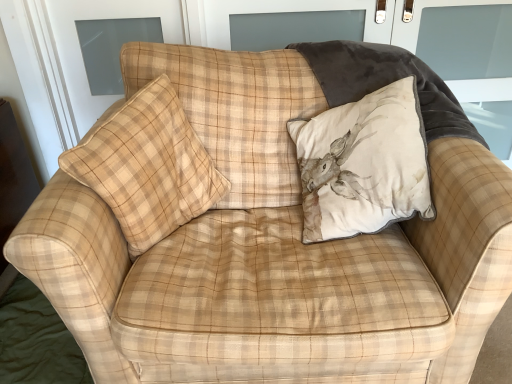
Question: From a real-world perspective, is beige plaid pillow at center, placed as the first pillow when sorted from left to right, beneath beige velvet cushion with deer print at upper right, acting as the 2th pillow starting from the left?

Choices:
 (A) no
 (B) yes

Answer: (A)

Question: Would you consider beige plaid pillow at center, placed as the first pillow when sorted from left to right, to be distant from beige velvet cushion with deer print at upper right, acting as the 2th pillow starting from the left?

Choices:
 (A) no
 (B) yes

Answer: (A)

Question: From the image's perspective, is beige plaid pillow at center, marked as the 2th pillow in a right-to-left arrangement, located above beige velvet cushion with deer print at upper right, the first pillow viewed from the right?

Choices:
 (A) no
 (B) yes

Answer: (A)

Question: Is beige plaid pillow at center, marked as the 2th pillow in a right-to-left arrangement, aimed at beige velvet cushion with deer print at upper right, the first pillow viewed from the right?

Choices:
 (A) yes
 (B) no

Answer: (B)

Question: Is beige plaid pillow at center, marked as the 2th pillow in a right-to-left arrangement, closer to the viewer compared to beige velvet cushion with deer print at upper right, the first pillow viewed from the right?

Choices:
 (A) no
 (B) yes

Answer: (B)

Question: From the image's perspective, is beige plaid pillow at center, placed as the first pillow when sorted from left to right, located beneath beige velvet cushion with deer print at upper right, the first pillow viewed from the right?

Choices:
 (A) yes
 (B) no

Answer: (A)

Question: Is velvet screen door at upper right aimed at beige velvet cushion with deer print at upper right, acting as the 2th pillow starting from the left?

Choices:
 (A) no
 (B) yes

Answer: (A)

Question: Considering the relative sizes of velvet screen door at upper right and beige velvet cushion with deer print at upper right, acting as the 2th pillow starting from the left, in the image provided, is velvet screen door at upper right smaller than beige velvet cushion with deer print at upper right, acting as the 2th pillow starting from the left,?

Choices:
 (A) no
 (B) yes

Answer: (B)

Question: Considering the relative positions of velvet screen door at upper right and beige velvet cushion with deer print at upper right, the first pillow viewed from the right, in the image provided, is velvet screen door at upper right to the left of beige velvet cushion with deer print at upper right, the first pillow viewed from the right, from the viewer's perspective?

Choices:
 (A) yes
 (B) no

Answer: (B)

Question: Would you say velvet screen door at upper right is outside beige velvet cushion with deer print at upper right, acting as the 2th pillow starting from the left?

Choices:
 (A) yes
 (B) no

Answer: (A)

Question: Does velvet screen door at upper right have a lesser height compared to beige velvet cushion with deer print at upper right, acting as the 2th pillow starting from the left?

Choices:
 (A) no
 (B) yes

Answer: (A)

Question: From a real-world perspective, is velvet screen door at upper right over beige velvet cushion with deer print at upper right, the first pillow viewed from the right?

Choices:
 (A) no
 (B) yes

Answer: (A)

Question: Is beige velvet cushion with deer print at upper right, acting as the 2th pillow starting from the left, looking in the opposite direction of velvet screen door at upper right?

Choices:
 (A) yes
 (B) no

Answer: (B)